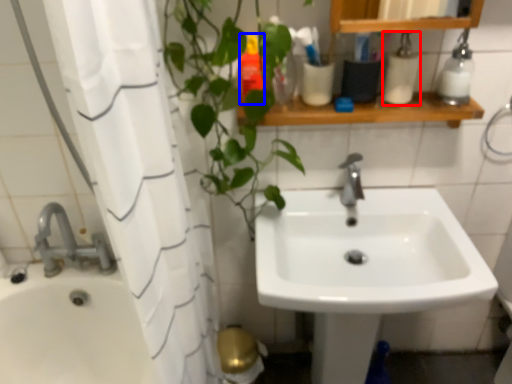
Question: Which point is closer to the camera, toiletry (highlighted by a red box) or toiletry (highlighted by a blue box)?

Choices:
 (A) toiletry
 (B) toiletry

Answer: (A)